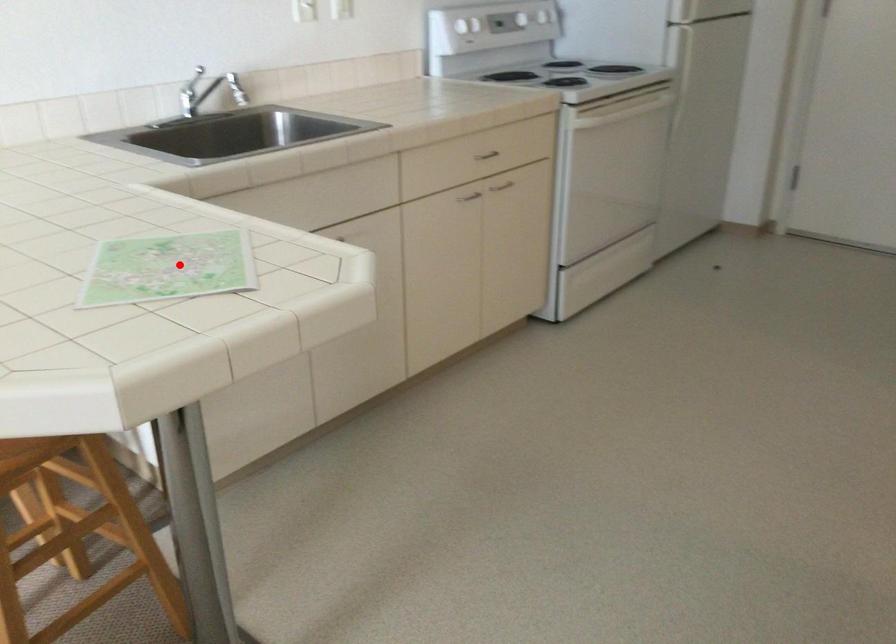
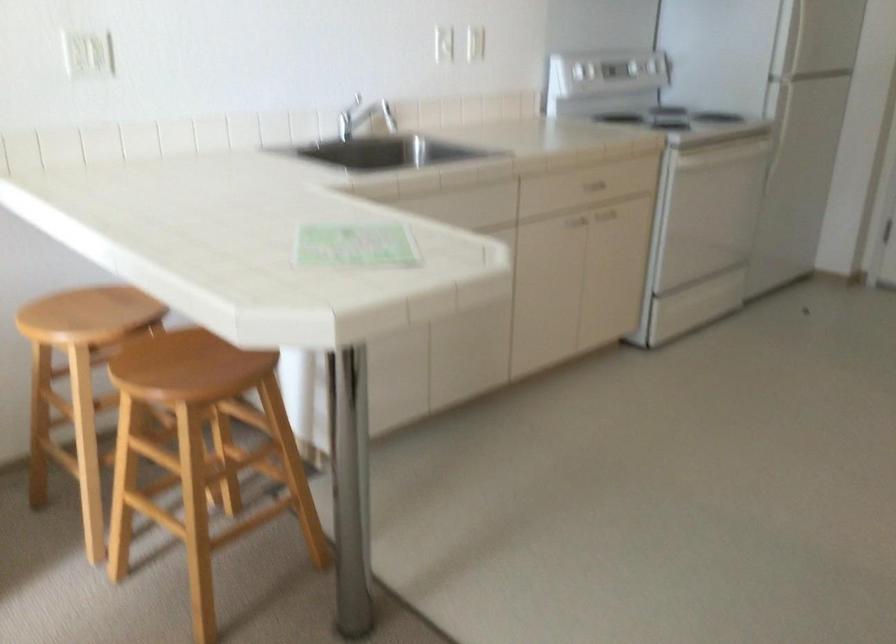
Question: I am providing you with two images of the same scene from different viewpoints. Image1 has a red point marked. In image2, the corresponding 3D location appears at what relative position? Reply with the corresponding letter.

Choices:
 (A) Closer
 (B) Farther

Answer: (B)